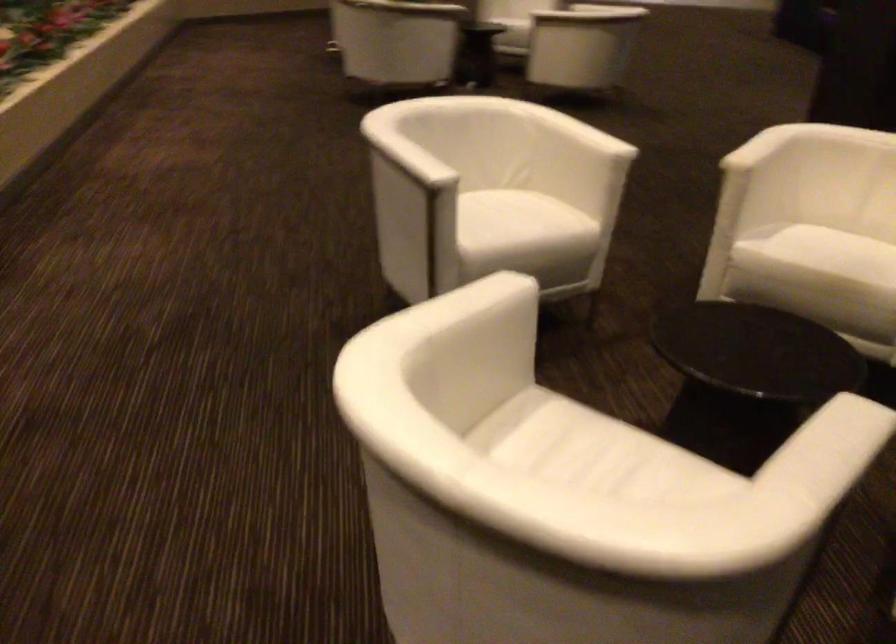
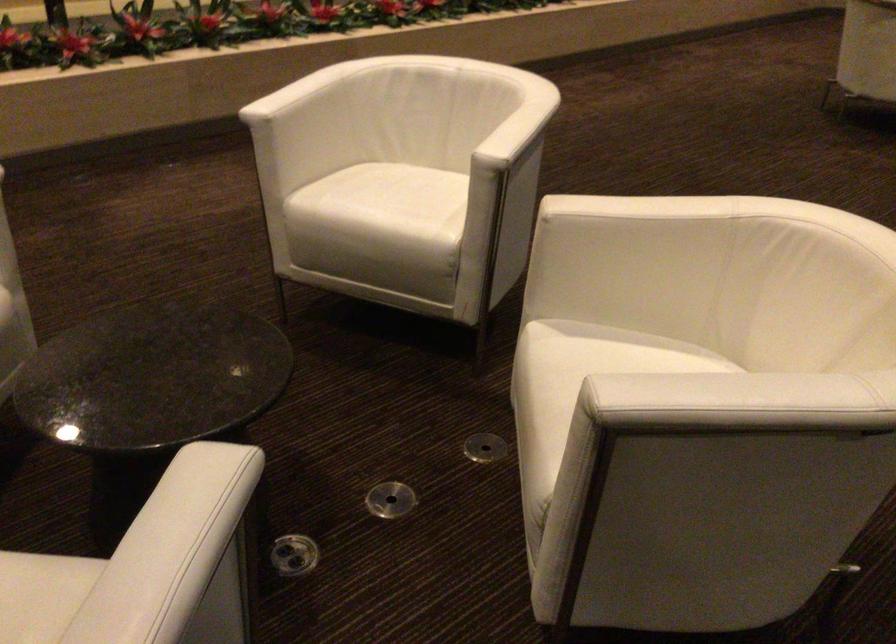
The point at [529,223] is marked in the first image. Where is the corresponding point in the second image?

(383, 205)